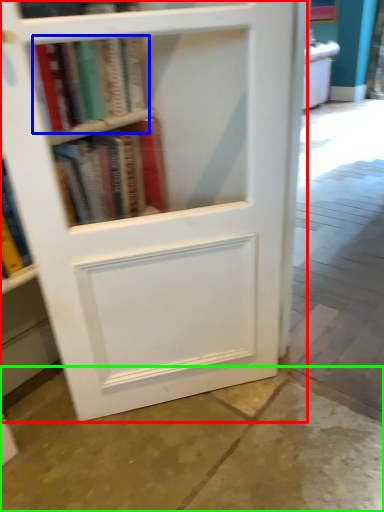
Question: Which object is the farthest from bookcase (highlighted by a red box)? Choose among these: book (highlighted by a blue box) or concrete (highlighted by a green box).

Choices:
 (A) book
 (B) concrete

Answer: (B)